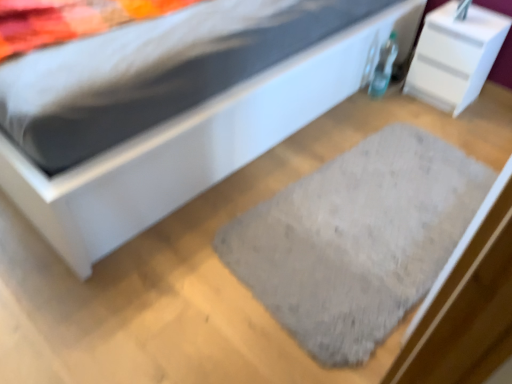
Locate an element on the screen. The image size is (512, 384). free point below gray fuzzy rug at center (from a real-world perspective) is located at coordinates (371, 219).